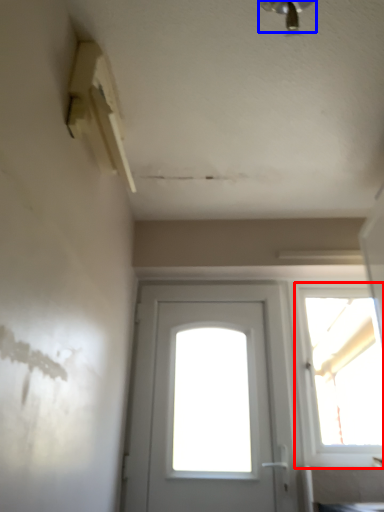
Question: Which point is further to the camera, window (highlighted by a red box) or light fixture (highlighted by a blue box)?

Choices:
 (A) window
 (B) light fixture

Answer: (A)